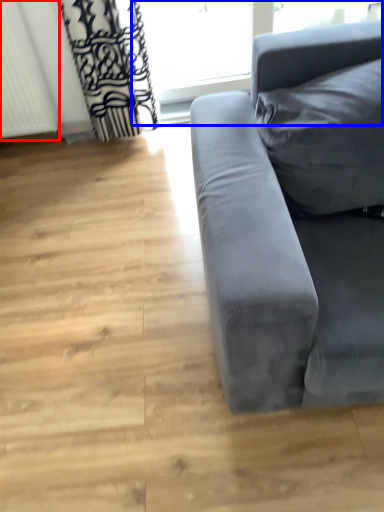
Question: Which of the following is the closest to the observer, radiator (highlighted by a red box) or window frame (highlighted by a blue box)?

Choices:
 (A) radiator
 (B) window frame

Answer: (A)